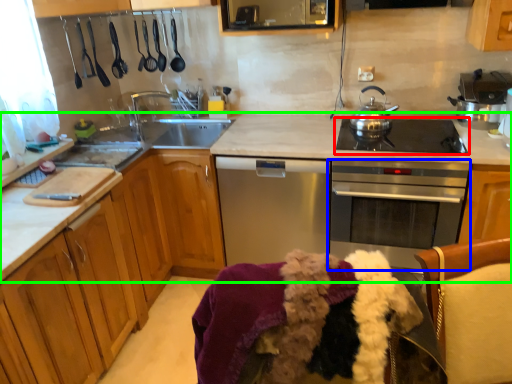
Question: Based on their relative distances, which object is nearer to gas stove (highlighted by a red box)? Choose from oven (highlighted by a blue box) and countertop (highlighted by a green box).

Choices:
 (A) oven
 (B) countertop

Answer: (B)